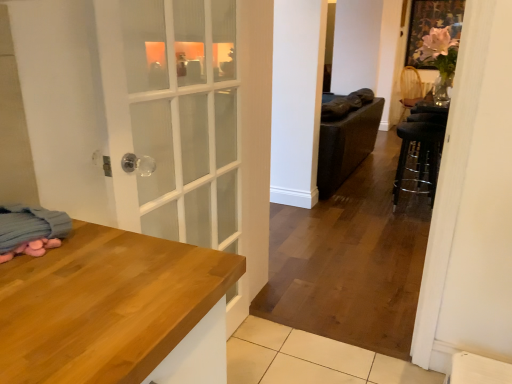
Question: Could you tell me if black metal bar stool at right is turned towards blue soft blanket at lower left?

Choices:
 (A) yes
 (B) no

Answer: (B)

Question: Is black metal bar stool at right to the right of blue soft blanket at lower left from the viewer's perspective?

Choices:
 (A) yes
 (B) no

Answer: (A)

Question: Can you confirm if black metal bar stool at right is bigger than blue soft blanket at lower left?

Choices:
 (A) no
 (B) yes

Answer: (B)

Question: Could blue soft blanket at lower left be considered to be inside black metal bar stool at right?

Choices:
 (A) yes
 (B) no

Answer: (B)

Question: Is blue soft blanket at lower left at the back of black metal bar stool at right?

Choices:
 (A) no
 (B) yes

Answer: (A)

Question: From the image's perspective, relative to woven wicker chair at upper right, is black metal bar stool at right above or below?

Choices:
 (A) above
 (B) below

Answer: (B)

Question: In the image, is black metal bar stool at right positioned in front of or behind woven wicker chair at upper right?

Choices:
 (A) behind
 (B) front

Answer: (B)

Question: From a real-world perspective, relative to woven wicker chair at upper right, is black metal bar stool at right vertically above or below?

Choices:
 (A) above
 (B) below

Answer: (B)

Question: Does point (437, 150) appear closer or farther from the camera than point (413, 77)?

Choices:
 (A) closer
 (B) farther

Answer: (A)

Question: Is point (35, 249) positioned closer to the camera than point (402, 162)?

Choices:
 (A) farther
 (B) closer

Answer: (B)

Question: Is blue soft blanket at lower left bigger or smaller than black metal bar stool at right?

Choices:
 (A) small
 (B) big

Answer: (A)

Question: Is blue soft blanket at lower left inside or outside of black metal bar stool at right?

Choices:
 (A) inside
 (B) outside

Answer: (B)

Question: From the image's perspective, is blue soft blanket at lower left above or below black metal bar stool at right?

Choices:
 (A) below
 (B) above

Answer: (A)

Question: In terms of size, does woven wicker chair at upper right appear bigger or smaller than black metal bar stool at right?

Choices:
 (A) big
 (B) small

Answer: (A)

Question: From the image's perspective, is woven wicker chair at upper right positioned above or below black metal bar stool at right?

Choices:
 (A) above
 (B) below

Answer: (A)